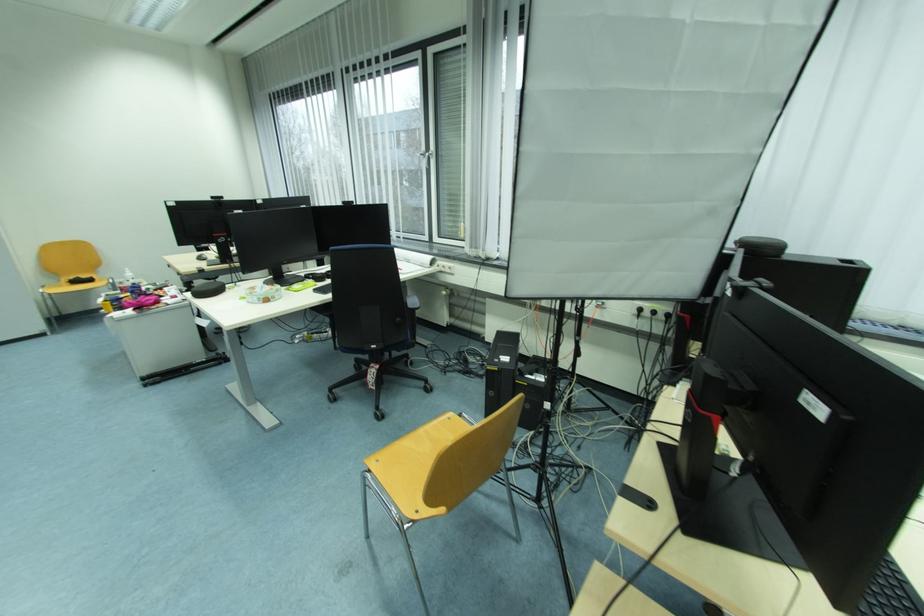
Which object does [890,593] point to?

It refers to a black keyboard.